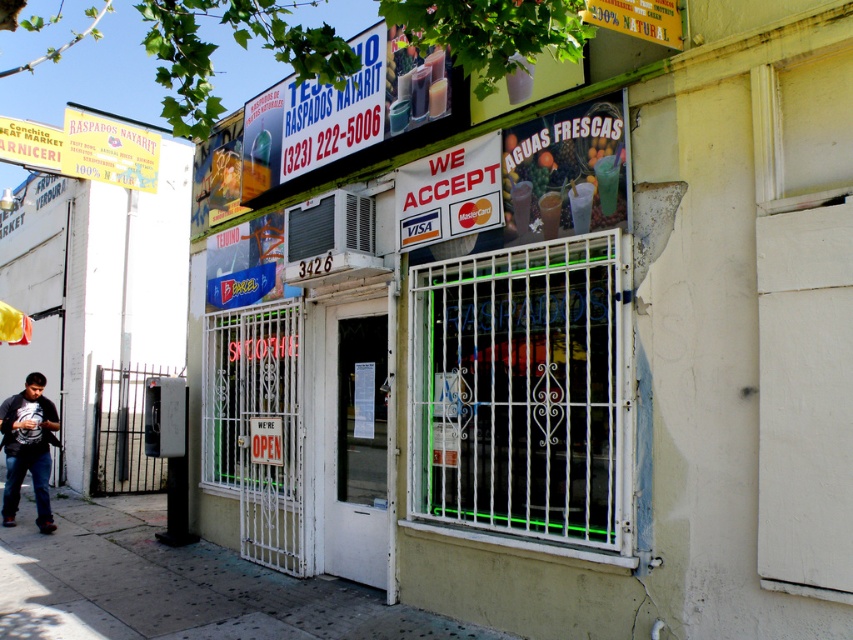
You are standing on the gray concrete sidewalk at lower left and want to place the dark gray cotton shirt at lower left on the sidewalk. Will the shirt fit entirely on the sidewalk without overlapping the edges?

The gray concrete sidewalk at lower left is wider than the dark gray cotton shirt at lower left, so the shirt will fit entirely on the sidewalk without overlapping the edges.

You are standing on the gray concrete sidewalk at lower left and want to pick up the dark gray cotton shirt at lower left. Is the shirt within your immediate reach without moving your feet?

The gray concrete sidewalk at lower left is closer to the viewer than dark gray cotton shirt at lower left, so the shirt is farther away and may not be within immediate reach without moving closer.

You are a pedestrian standing on the gray concrete sidewalk at lower left and want to look at the dark gray cotton shirt at lower left. Which direction should you move to see it better?

The gray concrete sidewalk at lower left is positioned on the right side of dark gray cotton shirt at lower left. To see the dark gray cotton shirt at lower left better, you should move to the left side of the gray concrete sidewalk at lower left.